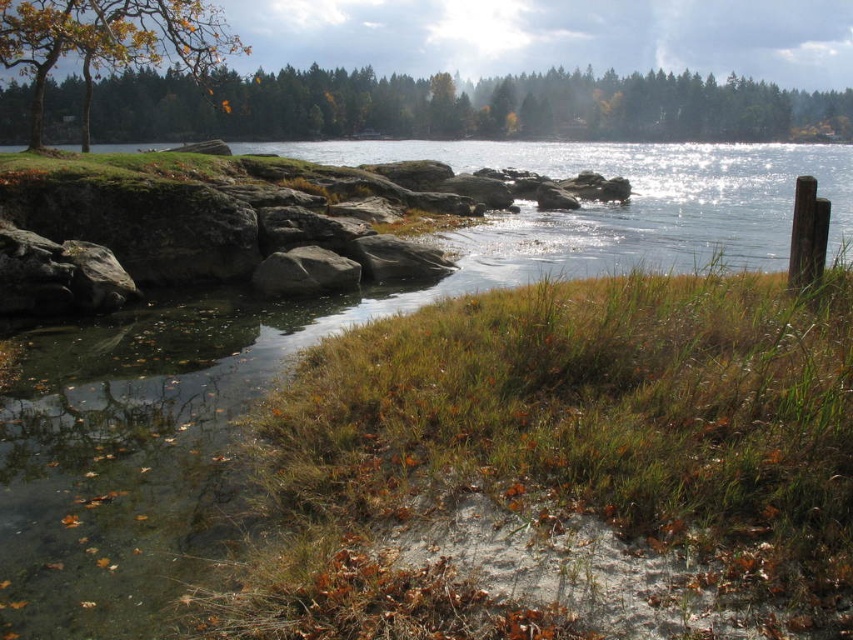
You are an artist sketching the lakeside scene. You notice the green matte tree at upper center and the brown textured tree at upper left. Which tree is closer to you in the composition?

The green matte tree at upper center is closer to you because the brown textured tree at upper left is positioned behind it.

You are standing at the lakeside and want to take a photo of both the brown textured tree at upper left and the gray rough rock at center. Which object should you position to your left to include both in the frame?

You should position the brown textured tree at upper left to your left since it is already to the left of the gray rough rock at center, allowing both to be captured in the photo frame.

You are an artist planning to sketch the scene. You want to ensure the brown textured tree at upper left and gray rough rock at center are proportionally accurate. Which object should you draw wider in your sketch?

The brown textured tree at upper left should be drawn wider than the gray rough rock at center because its width surpasses the rock.